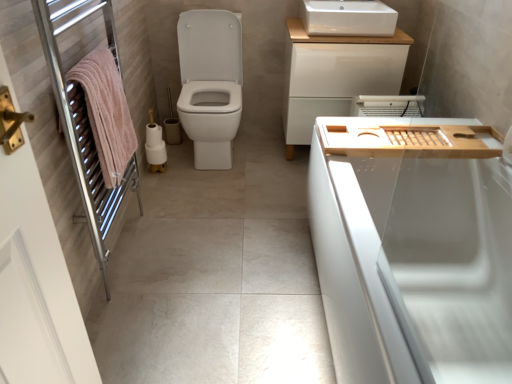
Question: Does pink soft towel at left have a lesser width compared to wooden tray at right?

Choices:
 (A) no
 (B) yes

Answer: (B)

Question: Is pink soft towel at left next to wooden tray at right?

Choices:
 (A) yes
 (B) no

Answer: (B)

Question: Is pink soft towel at left surrounding wooden tray at right?

Choices:
 (A) yes
 (B) no

Answer: (B)

Question: Can we say pink soft towel at left lies outside wooden tray at right?

Choices:
 (A) no
 (B) yes

Answer: (B)

Question: From the image's perspective, does pink soft towel at left appear higher than wooden tray at right?

Choices:
 (A) yes
 (B) no

Answer: (A)

Question: Considering the positions of point (146, 135) and point (382, 92), is point (146, 135) closer or farther from the camera than point (382, 92)?

Choices:
 (A) closer
 (B) farther

Answer: (B)

Question: In terms of width, does white matte toilet paper at center look wider or thinner when compared to white matte cabinet at upper center?

Choices:
 (A) wide
 (B) thin

Answer: (B)

Question: Looking at the image, does white matte toilet paper at center seem bigger or smaller compared to white matte cabinet at upper center?

Choices:
 (A) small
 (B) big

Answer: (A)

Question: Choose the correct answer: Is white matte toilet paper at center inside white matte cabinet at upper center or outside it?

Choices:
 (A) outside
 (B) inside

Answer: (A)

Question: From the image's perspective, is white ceramic sink at upper center above or below wooden tray at right?

Choices:
 (A) above
 (B) below

Answer: (A)

Question: Based on their positions, is white ceramic sink at upper center located to the left or right of wooden tray at right?

Choices:
 (A) left
 (B) right

Answer: (A)

Question: In terms of height, does white ceramic sink at upper center look taller or shorter compared to wooden tray at right?

Choices:
 (A) short
 (B) tall

Answer: (B)

Question: Relative to wooden tray at right, is white ceramic sink at upper center in front or behind?

Choices:
 (A) behind
 (B) front

Answer: (A)

Question: From a real-world perspective, is white glossy bathtub at right positioned above or below pink towel at left?

Choices:
 (A) above
 (B) below

Answer: (B)

Question: Do you think white glossy bathtub at right is within pink towel at left, or outside of it?

Choices:
 (A) outside
 (B) inside

Answer: (A)